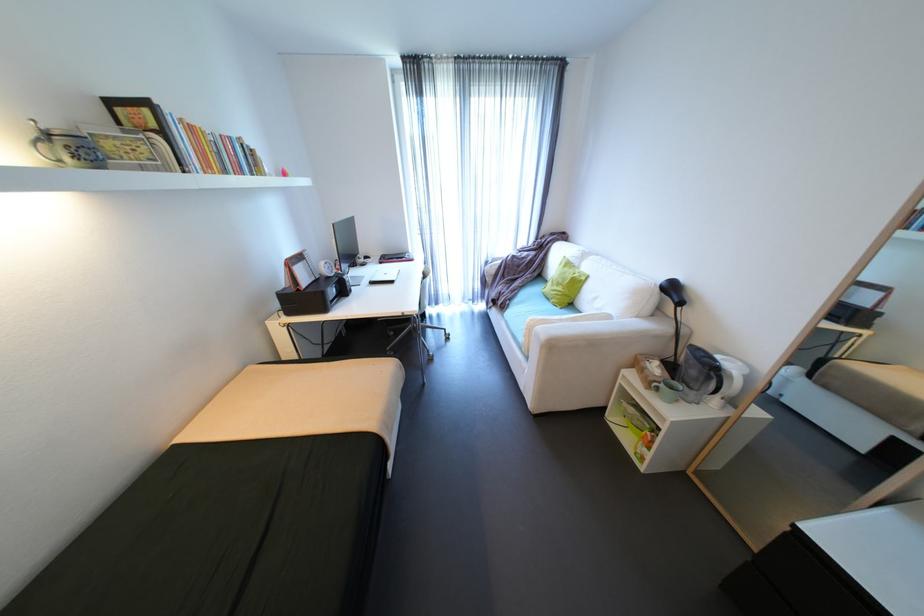
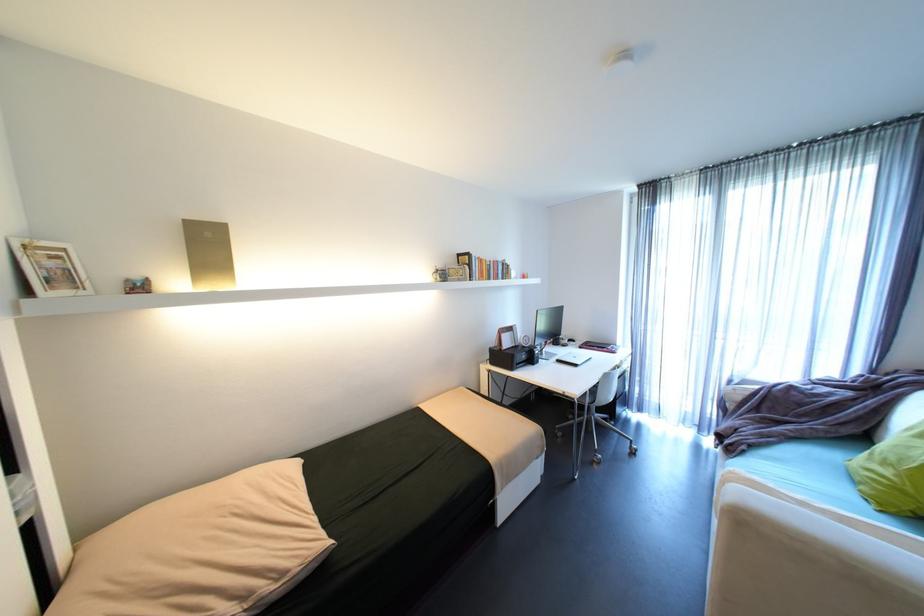
Locate, in the second image, the point that corresponds to [516,305] in the first image.

(751, 451)